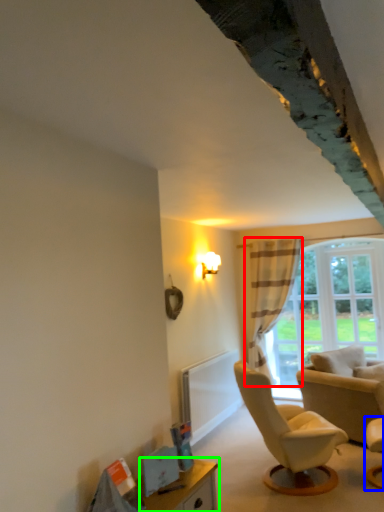
Question: Which is farther away from curtain (highlighted by a red box)? chair (highlighted by a blue box) or table (highlighted by a green box)?

Choices:
 (A) chair
 (B) table

Answer: (B)